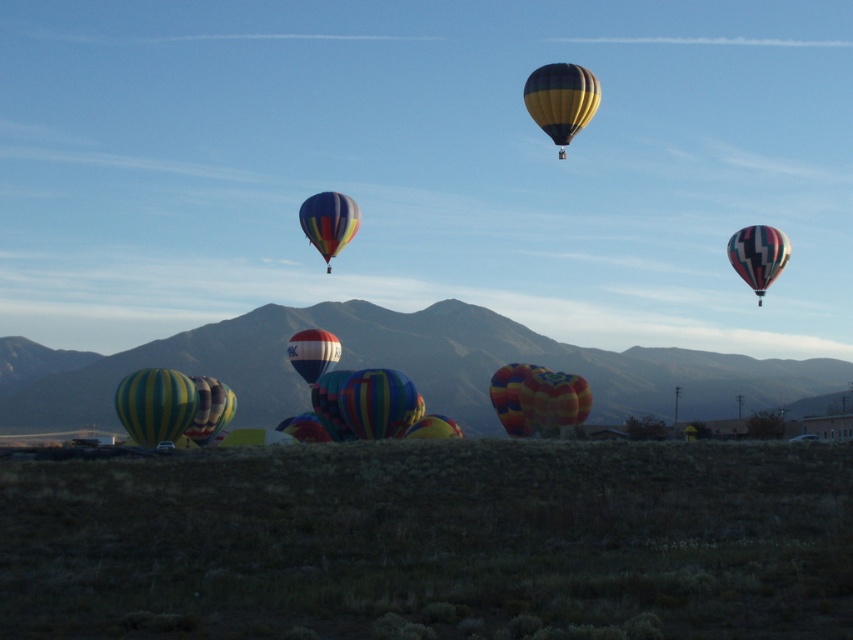
Which of these two, yellow-green striped balloon at lower left or multicolored fabric balloon at upper center, stands shorter?

Standing shorter between the two is yellow-green striped balloon at lower left.

Can you confirm if yellow-green striped balloon at lower left is positioned above multicolored fabric balloon at upper center?

No.

Describe the element at coordinates (155, 404) in the screenshot. I see `yellow-green striped balloon at lower left` at that location.

The image size is (853, 640). I want to click on yellow-green striped balloon at lower left, so click(155, 404).

Does shiny metallic balloon at upper right have a larger size compared to multicolored fabric hot air balloon at lower left?

Incorrect, shiny metallic balloon at upper right is not larger than multicolored fabric hot air balloon at lower left.

Where is `shiny metallic balloon at upper right`? shiny metallic balloon at upper right is located at coordinates (758, 256).

You are a GUI agent. You are given a task and a screenshot of the screen. Output one action in this format:
    pyautogui.click(x=<x>, y=<y>)
    Task: Click on the shiny metallic balloon at upper right
    The height and width of the screenshot is (640, 853).
    Given the screenshot: What is the action you would take?
    pyautogui.click(x=758, y=256)

Locate an element on the screen. This screenshot has height=640, width=853. rugged brown mountain at center is located at coordinates (409, 368).

From the picture: Does rugged brown mountain at center have a lesser width compared to red and white striped balloon at center?

No, rugged brown mountain at center is not thinner than red and white striped balloon at center.

Is point (416, 310) in front of point (328, 332)?

No, it is behind (328, 332).

Locate an element on the screen. This screenshot has height=640, width=853. rugged brown mountain at center is located at coordinates (409, 368).